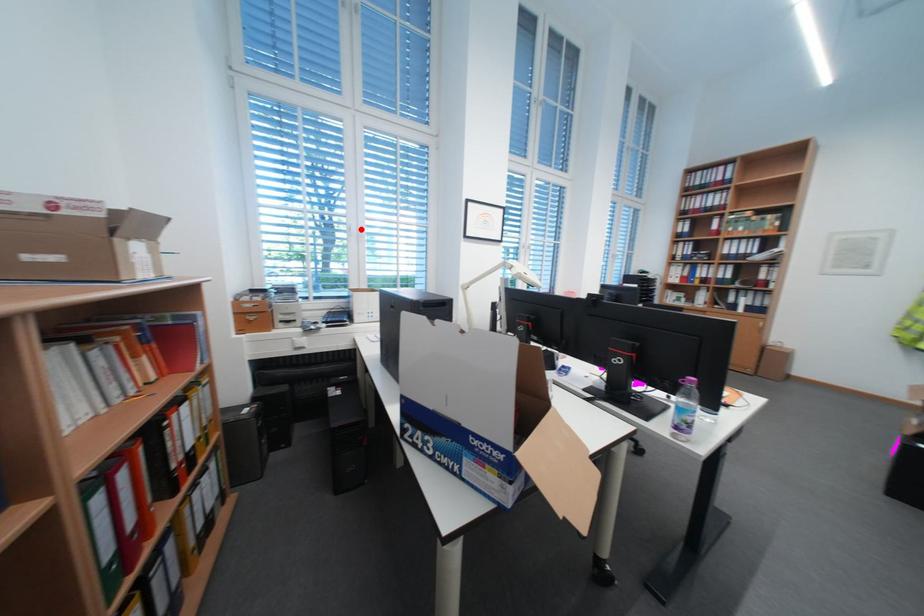
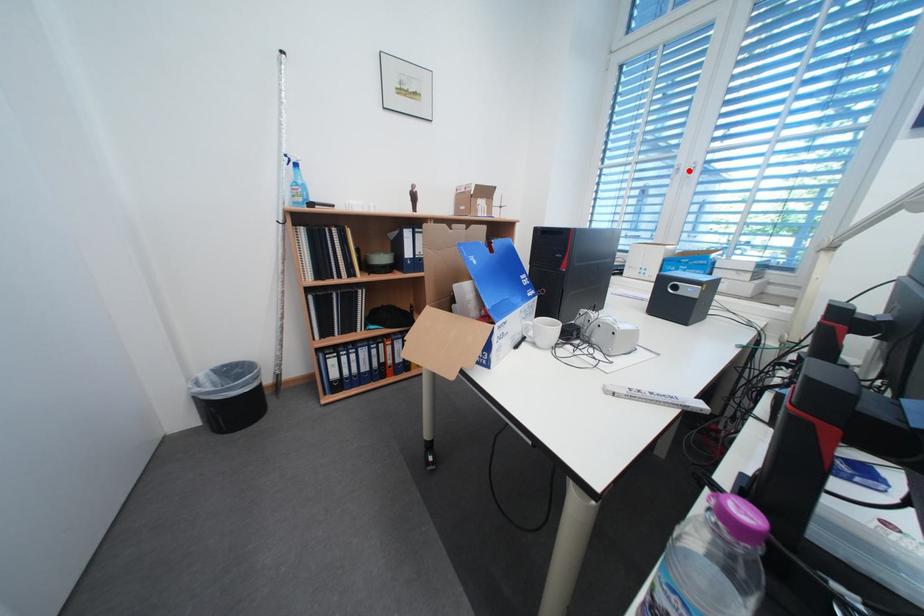
I am providing you with two images of the same scene from different viewpoints. A red point is marked on the first image and another point is marked on the second image. Are the points marked in image1 and image2 representing the same 3D position?

Yes